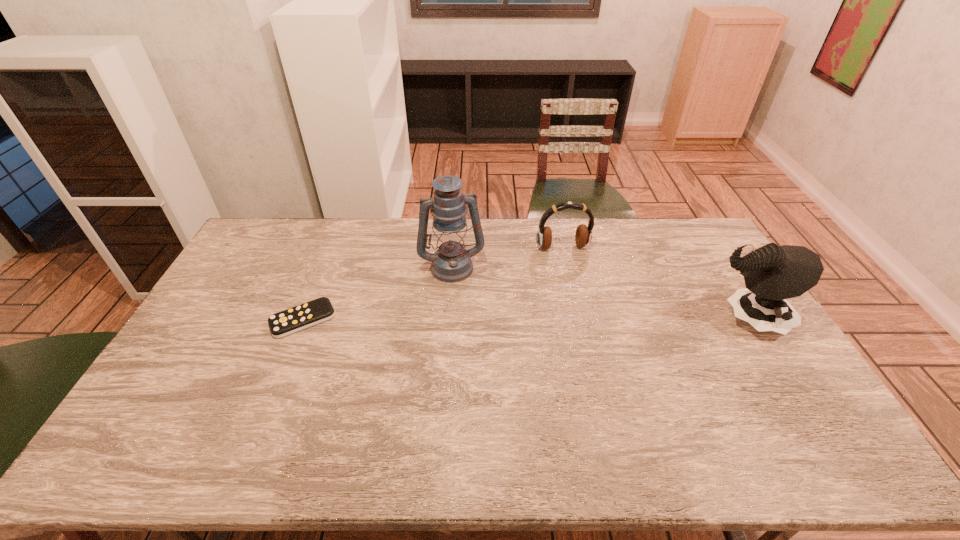
I want to click on free space located on the ear cup of the third object from left to right, so click(585, 302).

At what (x,y) coordinates should I click in order to perform the action: click on blank space located 0.210m on the ear cup of the third object from left to right. Please return your answer as a coordinate pair (x, y). The image size is (960, 540). Looking at the image, I should click on (582, 294).

Image resolution: width=960 pixels, height=540 pixels. What are the coordinates of `free region located 0.270m on the front-facing side of the tallest object` in the screenshot? It's located at (470, 343).

At what (x,y) coordinates should I click in order to perform the action: click on vacant space situated 0.270m on the front-facing side of the tallest object. Please return your answer as a coordinate pair (x, y). This screenshot has width=960, height=540. Looking at the image, I should click on (470, 343).

The width and height of the screenshot is (960, 540). What are the coordinates of `free location located 0.190m on the front-facing side of the tallest object` in the screenshot? It's located at (467, 323).

Identify the location of headset that is at the far edge. The height and width of the screenshot is (540, 960). (583, 235).

The height and width of the screenshot is (540, 960). I want to click on lantern positioned at the far edge, so click(451, 262).

Find the location of `object at the right edge`. object at the right edge is located at coordinates (772, 274).

At what (x,y) coordinates should I click in order to perform the action: click on vacant space at the far edge of the desktop. Please return your answer as a coordinate pair (x, y). Looking at the image, I should click on (314, 219).

Where is `blank space at the near edge of the desktop`? The height and width of the screenshot is (540, 960). blank space at the near edge of the desktop is located at coordinates point(219,395).